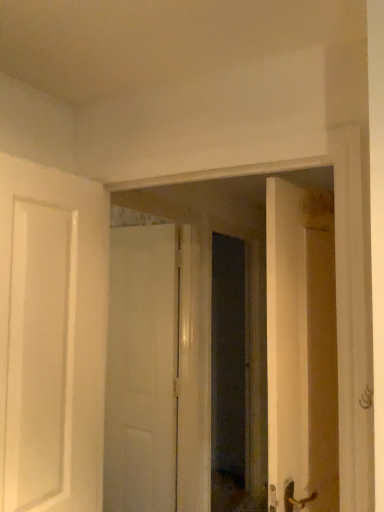
I want to click on transparent glass door at center, so click(256, 332).

The image size is (384, 512). Describe the element at coordinates (256, 332) in the screenshot. I see `transparent glass door at center` at that location.

I want to click on white matte door at center, so click(x=141, y=371).

What do you see at coordinates (141, 371) in the screenshot? I see `white matte door at center` at bounding box center [141, 371].

Where is `transparent glass door at center`? The width and height of the screenshot is (384, 512). transparent glass door at center is located at coordinates (256, 332).

Does white matte door at center appear on the right side of transparent glass door at center?

No, white matte door at center is not to the right of transparent glass door at center.

Considering their positions, is white matte door at center located in front of or behind transparent glass door at center?

Visually, white matte door at center is located behind transparent glass door at center.

Between point (148, 354) and point (150, 205), which one is positioned in front?

The point (150, 205) is in front.

From the image's perspective, is white matte door at center located above or below transparent glass door at center?

Based on their image positions, white matte door at center is located beneath transparent glass door at center.

From a real-world perspective, relative to transparent glass door at center, is white matte door at center vertically above or below?

white matte door at center is situated lower than transparent glass door at center in the real world.

Looking at their sizes, would you say white matte door at center is wider or thinner than transparent glass door at center?

In the image, white matte door at center appears to be more narrow than transparent glass door at center.

Considering the sizes of objects white matte door at center and transparent glass door at center in the image provided, who is shorter, white matte door at center or transparent glass door at center?

transparent glass door at center is shorter.

Can you confirm if white matte door at center is bigger than transparent glass door at center?

No, white matte door at center is not bigger than transparent glass door at center.

Would you say white matte door at center is inside or outside transparent glass door at center?

white matte door at center exists outside the volume of transparent glass door at center.

Is the surface of white matte door at center in direct contact with transparent glass door at center?

white matte door at center and transparent glass door at center are not in contact.

Is white matte door at center turned away from transparent glass door at center?

No, white matte door at center is not facing the opposite direction of transparent glass door at center.

Measure the distance from white matte door at center to transparent glass door at center.

white matte door at center and transparent glass door at center are 13.30 inches apart from each other.

This screenshot has width=384, height=512. I want to click on door located underneath the transparent glass door at center (from a real-world perspective), so [141, 371].

Based on the photo, visually, is transparent glass door at center positioned to the left or to the right of white matte door at center?

In the image, transparent glass door at center appears on the right side of white matte door at center.

Considering their positions, is transparent glass door at center located in front of or behind white matte door at center?

transparent glass door at center is positioned closer to the viewer than white matte door at center.

Does point (194, 243) come closer to viewer compared to point (124, 418)?

Yes, it is.

From the image's perspective, would you say transparent glass door at center is shown under white matte door at center?

Actually, transparent glass door at center appears above white matte door at center in the image.

From a real-world perspective, which object rests below the other?

From a 3D spatial view, white matte door at center is below.

Which object is thinner, transparent glass door at center or white matte door at center?

Thinner between the two is white matte door at center.

Is transparent glass door at center shorter than white matte door at center?

Yes.

Considering the sizes of transparent glass door at center and white matte door at center in the image, is transparent glass door at center bigger or smaller than white matte door at center?

Considering their sizes, transparent glass door at center takes up more space than white matte door at center.

Is transparent glass door at center positioned beyond the bounds of white matte door at center?

Yes, transparent glass door at center is located beyond the bounds of white matte door at center.

Is transparent glass door at center directly adjacent to white matte door at center?

No.

Is transparent glass door at center looking in the opposite direction of white matte door at center?

No, transparent glass door at center is not facing away from white matte door at center.

Locate an element on the screen. The height and width of the screenshot is (512, 384). door behind the transparent glass door at center is located at coordinates (141, 371).

Locate an element on the screen. glass door that is above the white matte door at center (from the image's perspective) is located at coordinates (256, 332).

Identify the location of glass door that is above the white matte door at center (from a real-world perspective). (256, 332).